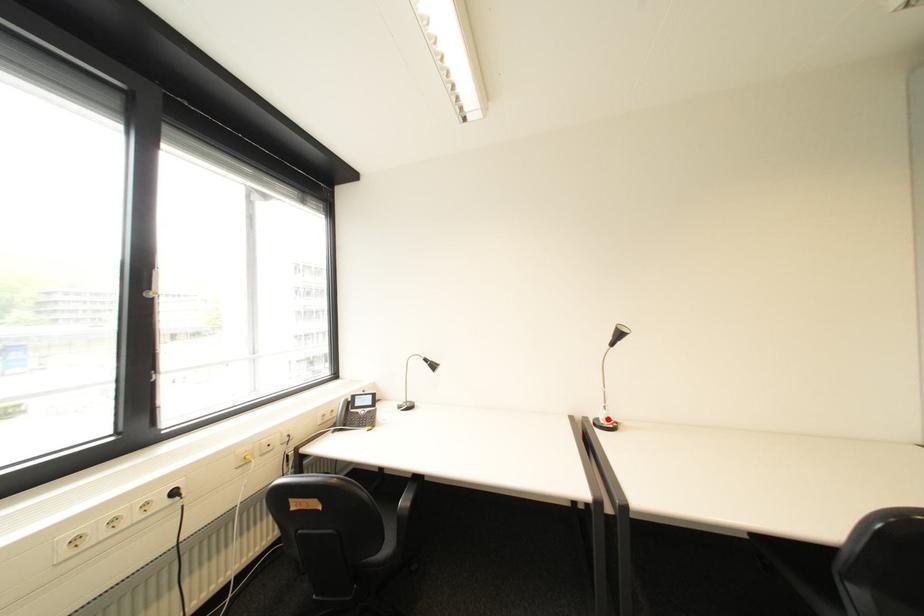
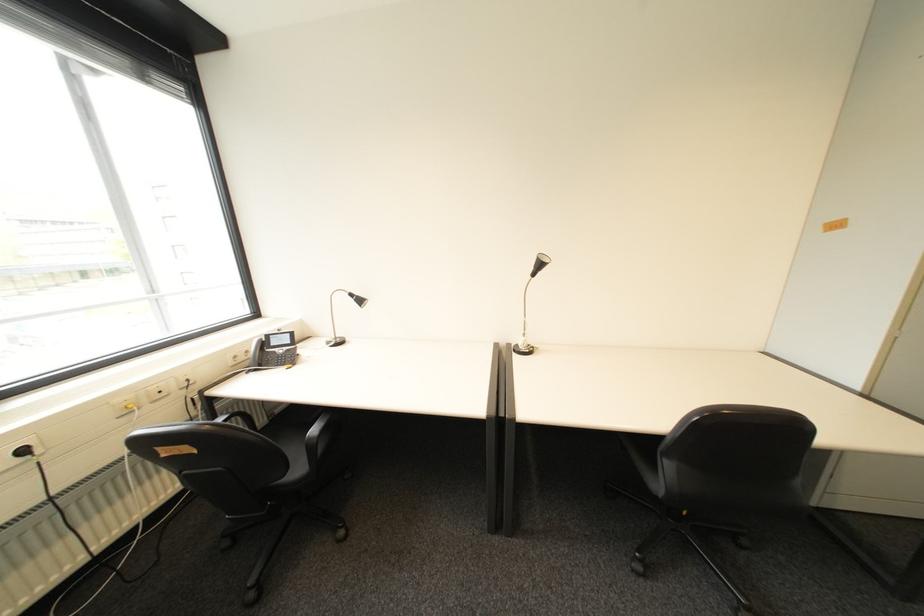
The point at the highlighted location is marked in the first image. Where is the corresponding point in the second image?

(528, 345)